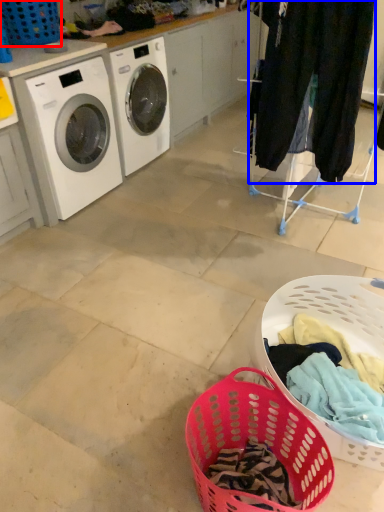
Question: Which of the following is the closest to the observer, basket (highlighted by a red box) or clothing (highlighted by a blue box)?

Choices:
 (A) basket
 (B) clothing

Answer: (B)